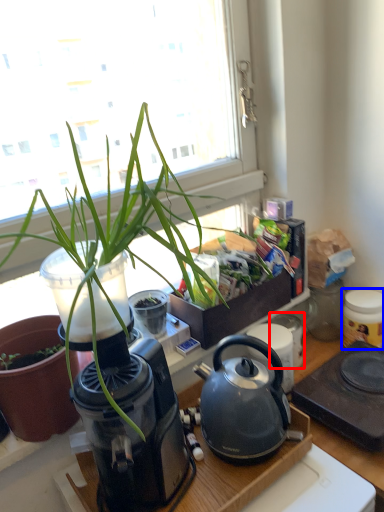
Question: Which of the following is the closest to the observer, appliance (highlighted by a red box) or appliance (highlighted by a blue box)?

Choices:
 (A) appliance
 (B) appliance

Answer: (B)